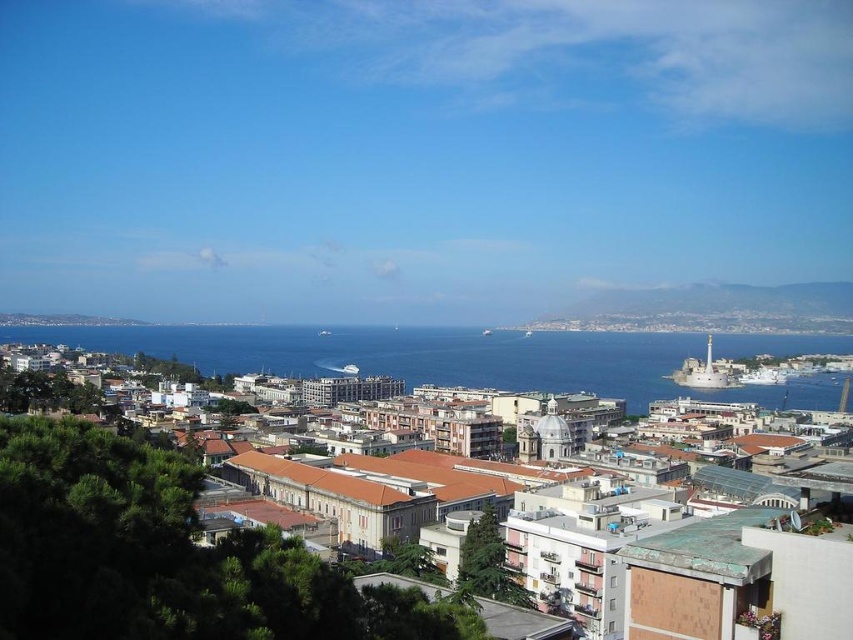
You are standing at the center of the city looking towards the sea. There are two points marked in the scene. The first point is at coordinates point (701, 326) and the second point is at point (718, 378). Which point is closer to you?

Point (701, 326) is closer to you because it is further to the viewer than point (718, 378).